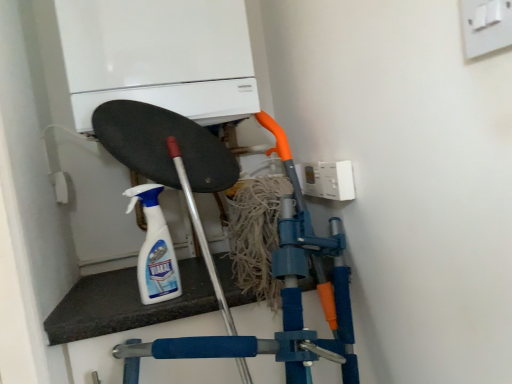
The height and width of the screenshot is (384, 512). I want to click on spots to the right of white plastic spray bottle at center, so click(x=209, y=291).